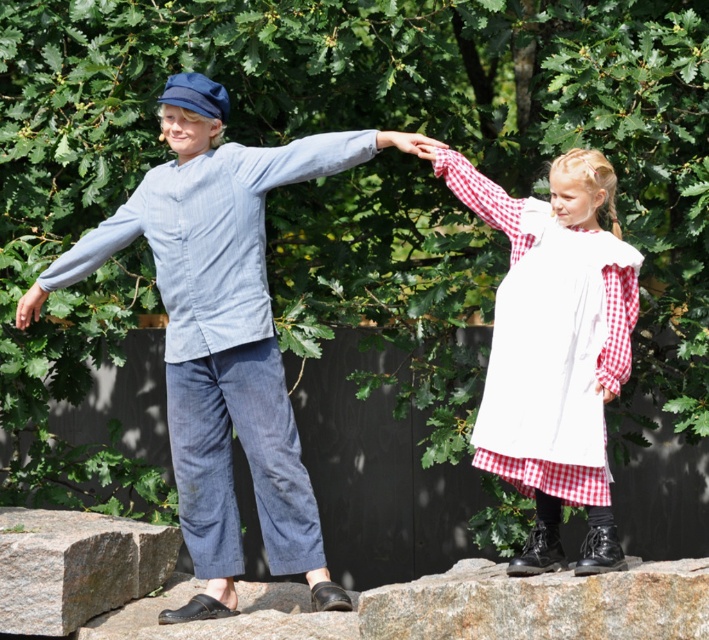
From the picture: Can you confirm if denim shirt sleeve at upper center is positioned to the right of matte blue jeans at left?

Correct, you'll find denim shirt sleeve at upper center to the right of matte blue jeans at left.

Does denim shirt sleeve at upper center appear on the left side of matte blue jeans at left?

In fact, denim shirt sleeve at upper center is to the right of matte blue jeans at left.

Is point (320, 154) closer to viewer compared to point (16, 326)?

Yes, it is in front of point (16, 326).

Identify the location of denim shirt sleeve at upper center. (318, 156).

Is white cotton dress at right below granite boulder at lower center?

No.

Is point (630, 248) behind point (452, 611)?

Yes, it is.

This screenshot has height=640, width=709. What are the coordinates of `white cotton dress at right` in the screenshot? It's located at (552, 349).

In the scene shown: Does denim pants at center appear on the right side of denim shirt sleeve at upper center?

No, denim pants at center is not to the right of denim shirt sleeve at upper center.

Between point (169, 179) and point (329, 168), which one is positioned in front?

Point (329, 168) is more forward.

This screenshot has width=709, height=640. What are the coordinates of `denim pants at center` in the screenshot? It's located at (223, 336).

At what (x,y) coordinates should I click in order to perform the action: click on denim pants at center. Please return your answer as a coordinate pair (x, y). The image size is (709, 640). Looking at the image, I should click on (223, 336).